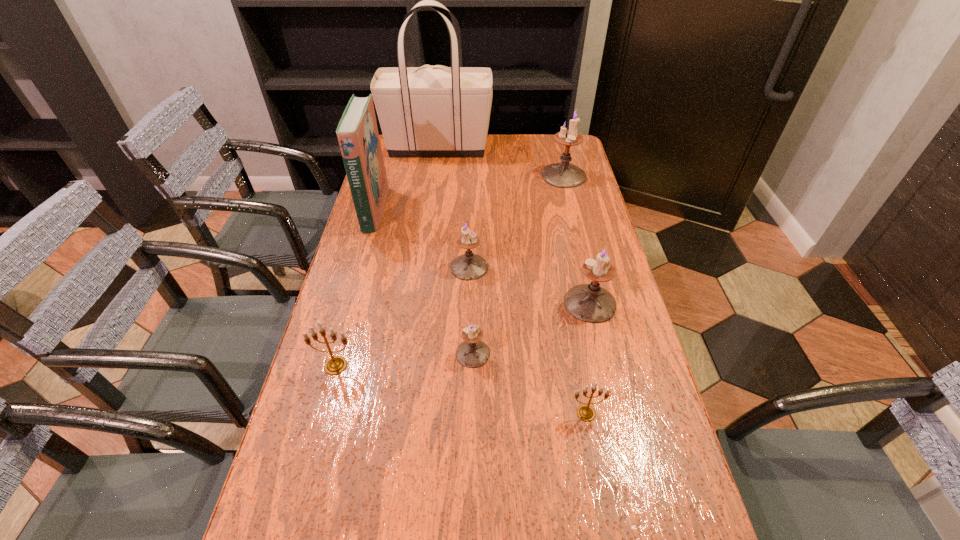
The image size is (960, 540). Identify the location of vacant space located 0.150m on the front of the bigger gold candelabrum. (316, 437).

Image resolution: width=960 pixels, height=540 pixels. Find the location of `vacant area situated 0.370m on the right of the smallest purple candle holder`. vacant area situated 0.370m on the right of the smallest purple candle holder is located at coordinates (641, 354).

Find the location of `vacant area situated on the front of the nearer gold candelabrum`. vacant area situated on the front of the nearer gold candelabrum is located at coordinates (595, 464).

Where is `shopping bag at the far edge`? shopping bag at the far edge is located at coordinates (436, 110).

At what (x,y) coordinates should I click in order to perform the action: click on candle holder positioned at the far edge. Please return your answer as a coordinate pair (x, y). Image resolution: width=960 pixels, height=540 pixels. Looking at the image, I should click on (563, 175).

This screenshot has height=540, width=960. Identify the location of shopping bag located in the left edge section of the desktop. (436, 110).

In order to click on hardback book that is at the left edge in this screenshot , I will do `click(357, 132)`.

Locate an element on the screen. candelabrum that is at the left edge is located at coordinates (335, 365).

This screenshot has width=960, height=540. I want to click on object present at the far left corner, so click(436, 110).

This screenshot has width=960, height=540. What are the coordinates of `object that is at the far right corner` in the screenshot? It's located at (563, 175).